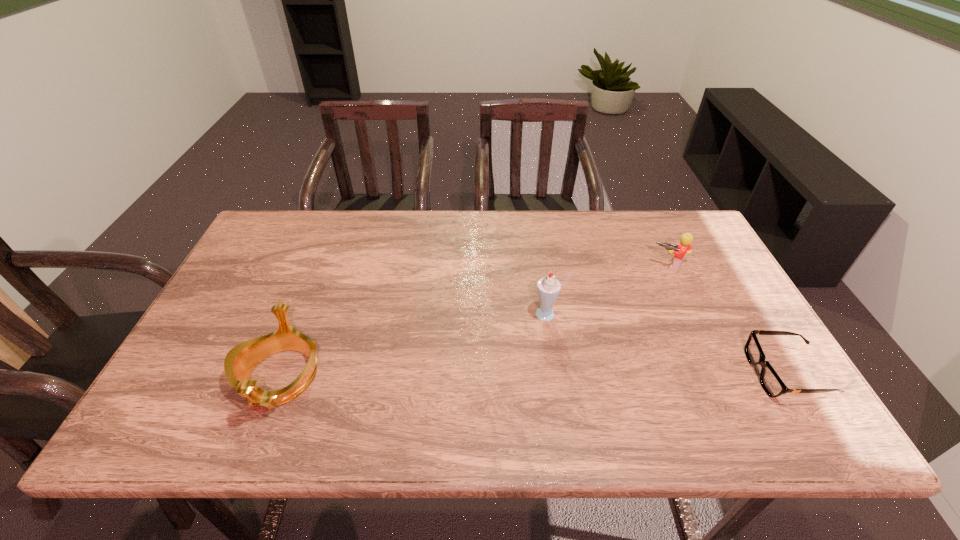
Find the location of a particular element. free space located 0.280m on the straw side of the tallest object is located at coordinates (467, 390).

At what (x,y) coordinates should I click in order to perform the action: click on vacant space positioned 0.210m on the straw side of the tallest object. Please return your answer as a coordinate pair (x, y). The image size is (960, 540). Looking at the image, I should click on (487, 371).

In order to click on vacant area situated on the straw side of the tallest object in this screenshot , I will do `click(481, 376)`.

Locate an element on the screen. The height and width of the screenshot is (540, 960). vacant space situated in front of the farthest object with the accessory visible is located at coordinates (636, 307).

This screenshot has width=960, height=540. Identify the location of vacant region located 0.180m in front of the farthest object with the accessory visible. (636, 307).

Locate an element on the screen. blank space located in front of the farthest object with the accessory visible is located at coordinates (604, 355).

Where is `tiara that is at the near edge`? Image resolution: width=960 pixels, height=540 pixels. tiara that is at the near edge is located at coordinates (241, 360).

The image size is (960, 540). I want to click on sunglasses present at the near edge, so click(x=770, y=381).

Identify the location of object at the left edge. The width and height of the screenshot is (960, 540). (241, 360).

The image size is (960, 540). Identify the location of sunglasses at the right edge. (770, 381).